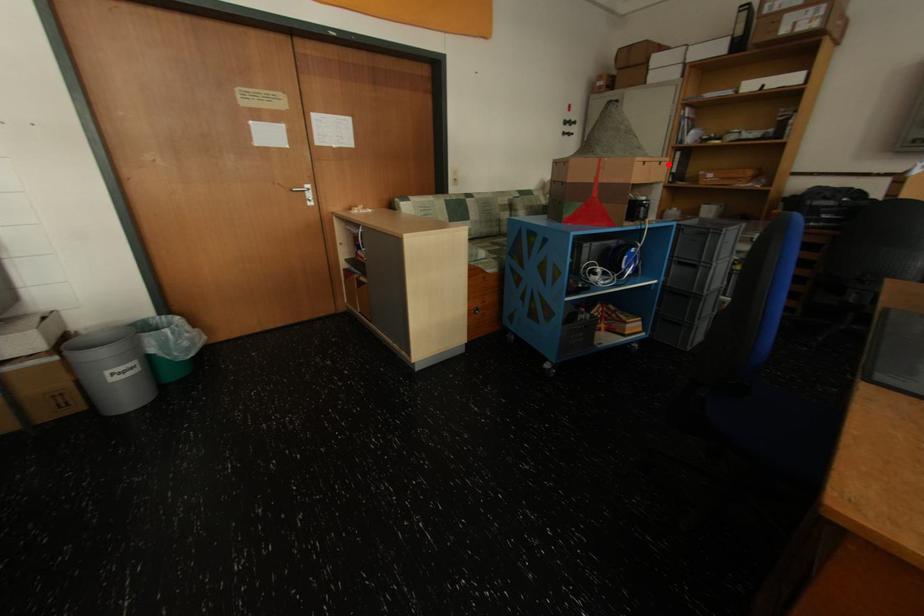
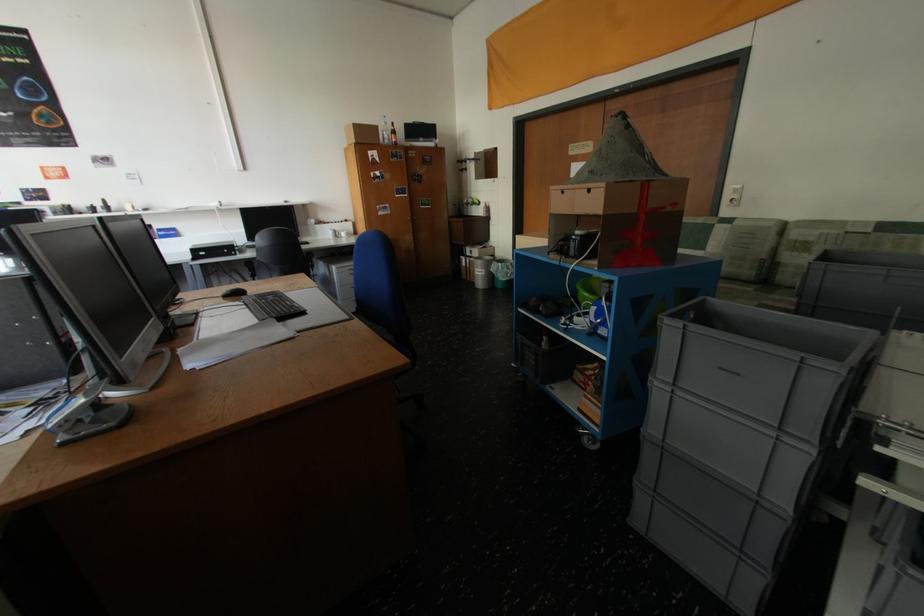
Find the pixel in the second image that matches the highlighted location in the first image.

(598, 192)